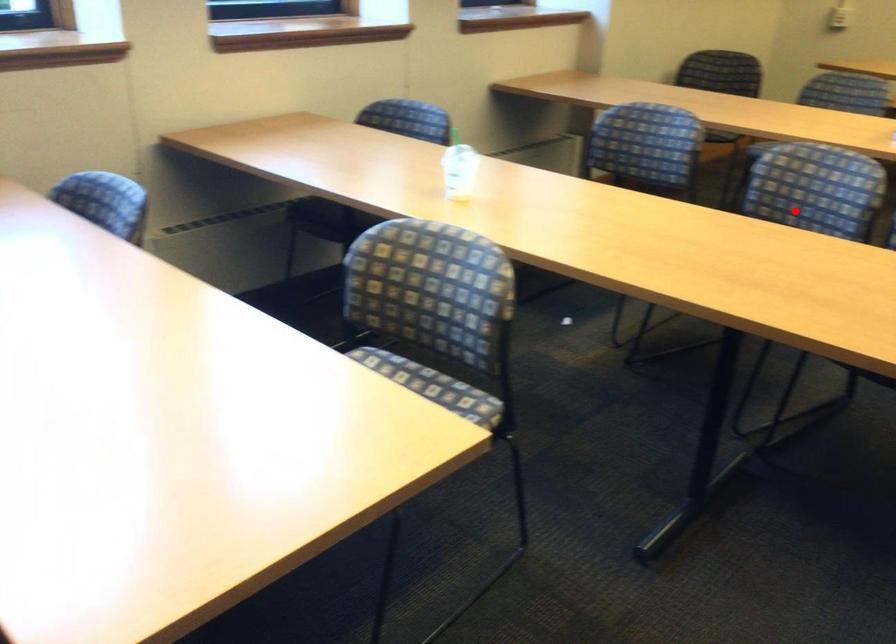
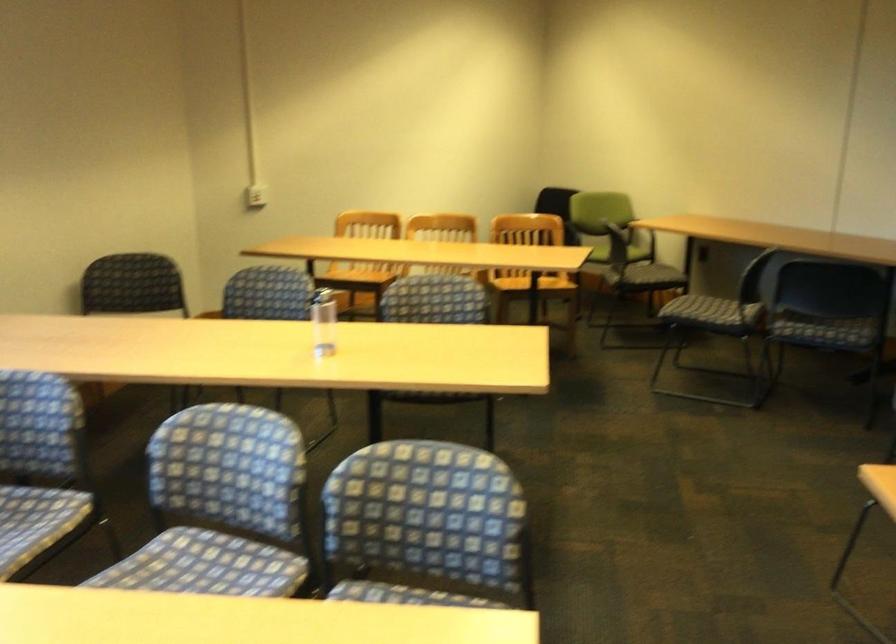
Question: I am providing you with two images of the same scene from different viewpoints. A red point is shown in image1. For the corresponding object point in image2, is it positioned nearer or farther from the camera?

Choices:
 (A) Nearer
 (B) Farther

Answer: (A)